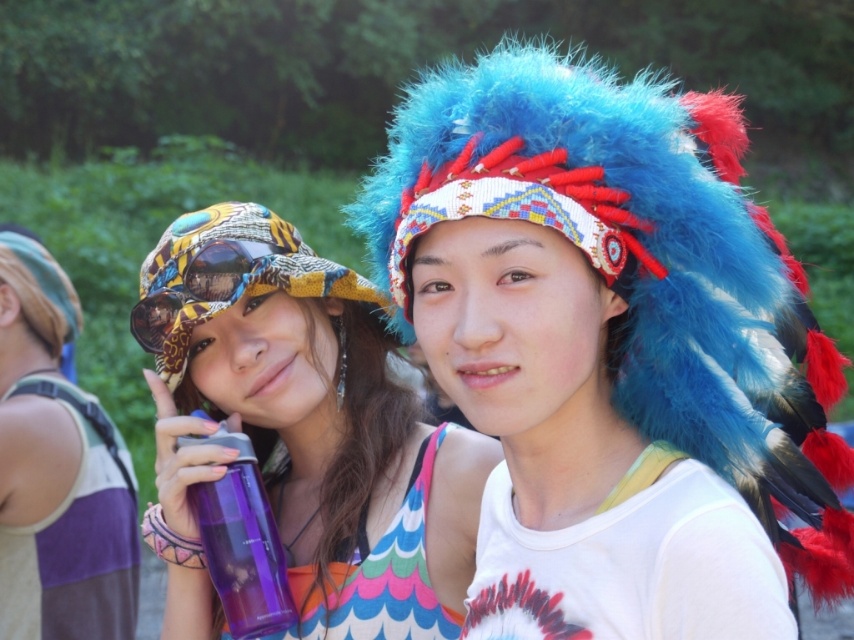
Question: Can you confirm if matte purple water bottle at left is smaller than leopard print fabric goggles at left?

Choices:
 (A) no
 (B) yes

Answer: (A)

Question: Which of the following is the closest to the observer?

Choices:
 (A) (347, 285)
 (B) (250, 582)
 (C) (589, 170)

Answer: (C)

Question: Which of the following is the closest to the observer?

Choices:
 (A) pos(572,236)
 (B) pos(185,214)

Answer: (A)

Question: Is matte purple water bottle at left thinner than leopard print fabric goggles at left?

Choices:
 (A) yes
 (B) no

Answer: (B)

Question: From the image, what is the correct spatial relationship of matte purple water bottle at left in relation to purple plastic water bottle at center?

Choices:
 (A) right
 (B) left

Answer: (A)

Question: Which object appears farthest from the camera in this image?

Choices:
 (A) matte purple water bottle at left
 (B) printed fabric bucket hat at left
 (C) fuzzy blue headdress at center

Answer: (B)